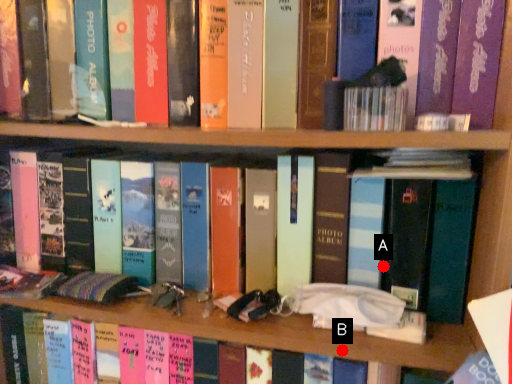
Question: Two points are circled on the image, labeled by A and B beside each circle. Which point appears closest to the camera in this image?

Choices:
 (A) A is closer
 (B) B is closer

Answer: (B)